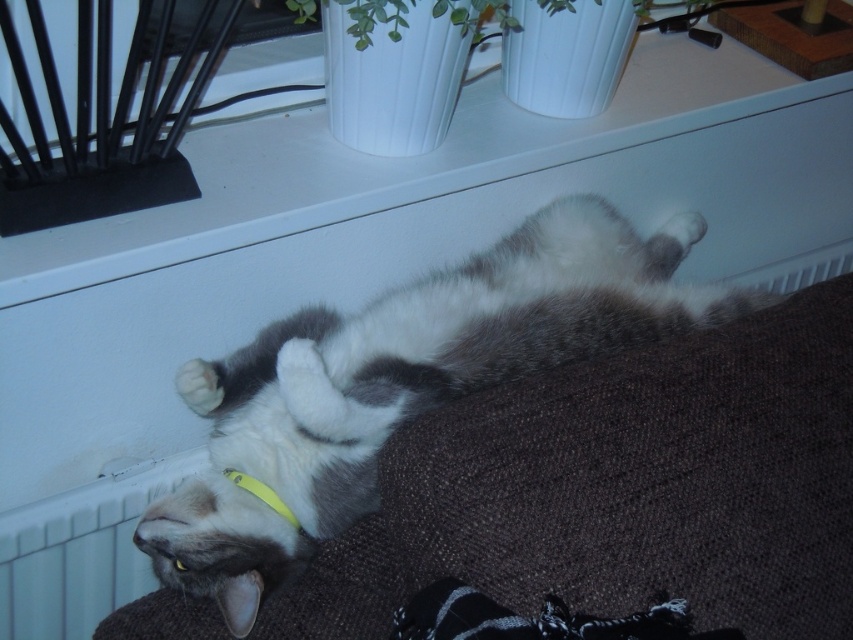
Question: Can you confirm if gray fur cat at center is positioned above yellow fabric neckband at lower center?

Choices:
 (A) no
 (B) yes

Answer: (B)

Question: Which point is closer to the camera taking this photo?

Choices:
 (A) [x=248, y=486]
 (B) [x=291, y=368]

Answer: (B)

Question: Which of the following is the farthest from the observer?

Choices:
 (A) (320, 308)
 (B) (273, 504)

Answer: (A)

Question: Is gray fur cat at center thinner than yellow fabric neckband at lower center?

Choices:
 (A) yes
 (B) no

Answer: (B)

Question: Which point appears closest to the camera in this image?

Choices:
 (A) (254, 404)
 (B) (277, 504)

Answer: (B)

Question: Does gray fur cat at center appear on the left side of yellow fabric neckband at lower center?

Choices:
 (A) yes
 (B) no

Answer: (B)